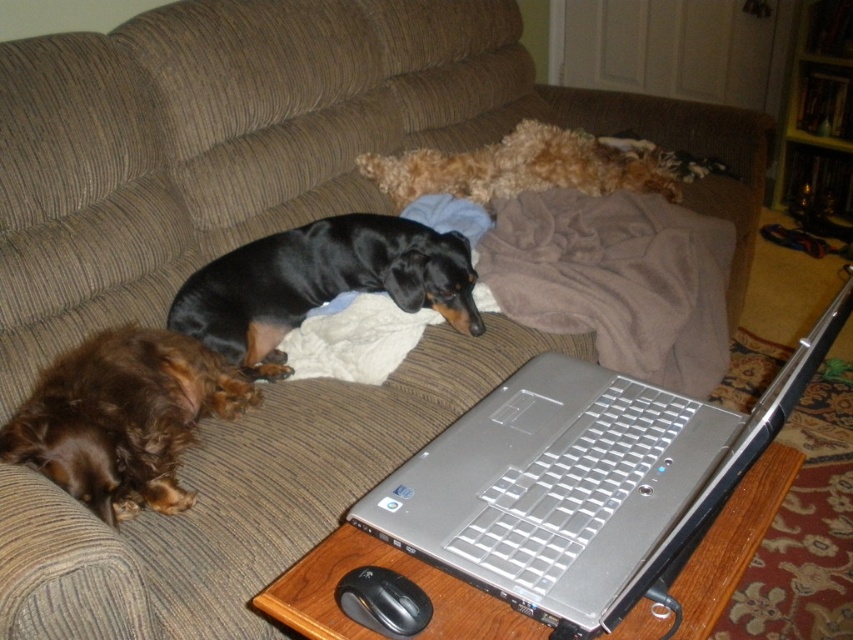
You are a delivery person who needs to place a small package on the coffee table. The package is 10 inches wide. Can the silver metallic laptop at center and the brown furry dog at lower left both fit on the table with the package?

The silver metallic laptop at center is wider than the brown furry dog at lower left. Since the package is 10 inches wide, it depends on the total space available. However, the description only provides a comparison between the laptop and the dog, not their exact sizes. Without knowing the exact dimensions of the laptop and the dog, it is impossible to determine if they can fit alongside the package.

You are a delivery person who needs to place a small package on the coffee table in front of the sofa. The package is 15 cm in length. Considering the silver metallic laptop at center and the brown furry dog at lower left, which object occupies more space on the table?

The silver metallic laptop at center has a larger size compared to the brown furry dog at lower left, so the silver metallic laptop at center occupies more space on the table.

You are a person sitting on the sofa and want to pick up the silver metallic laptop at center and the brown soft blanket at center. Which one is closer to your current position?

The silver metallic laptop at center is closer to your current position because it is to the left of the brown soft blanket at center, which is further away.